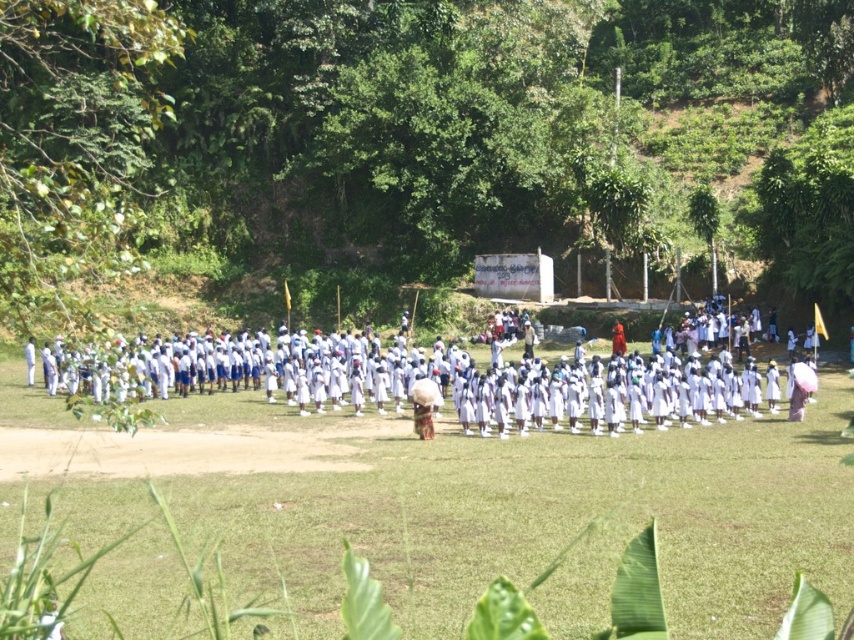
Can you confirm if white fabric at center is positioned above white cotton uniform at center?

Actually, white fabric at center is below white cotton uniform at center.

Does white fabric at center appear under white cotton uniform at center?

Yes.

Is point (489, 476) positioned behind point (423, 355)?

No, (489, 476) is closer to viewer.

Where is `white fabric at center`? Image resolution: width=854 pixels, height=640 pixels. white fabric at center is located at coordinates (531, 515).